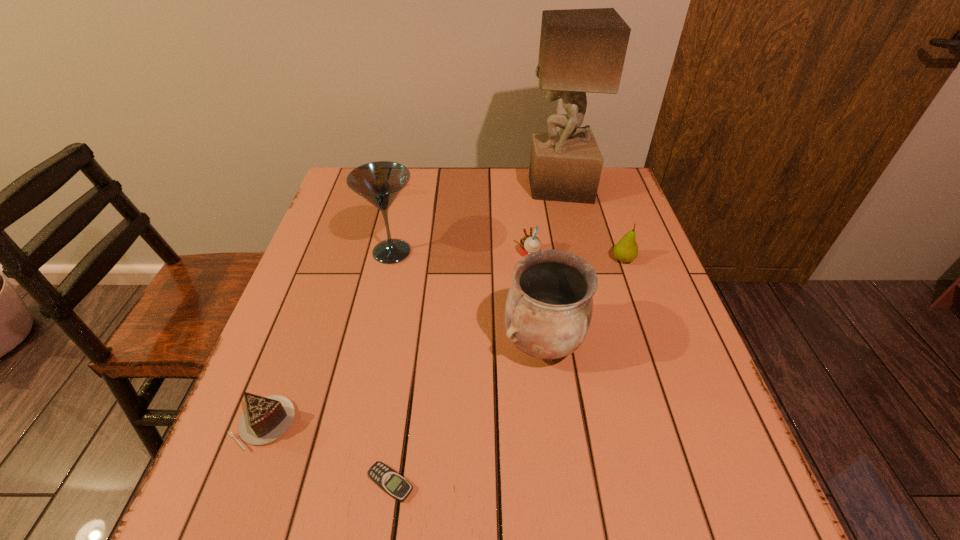
The image size is (960, 540). I want to click on the farthest object, so click(581, 50).

The height and width of the screenshot is (540, 960). I want to click on sculpture, so click(581, 50).

The width and height of the screenshot is (960, 540). In order to click on martini in this screenshot , I will do `click(380, 183)`.

In order to click on urn in this screenshot , I will do `click(549, 306)`.

This screenshot has width=960, height=540. What are the coordinates of `pear` in the screenshot? It's located at (626, 250).

At what (x,y) coordinates should I click in order to perform the action: click on muffin. Please return your answer as a coordinate pair (x, y). The image size is (960, 540). Looking at the image, I should click on (528, 244).

Where is `the leftmost object`? This screenshot has height=540, width=960. the leftmost object is located at coordinates (266, 419).

Where is `the second nearest object`? This screenshot has width=960, height=540. the second nearest object is located at coordinates (266, 419).

Locate an element on the screen. beeper is located at coordinates (394, 484).

The height and width of the screenshot is (540, 960). Identify the location of the shortest object. (394, 484).